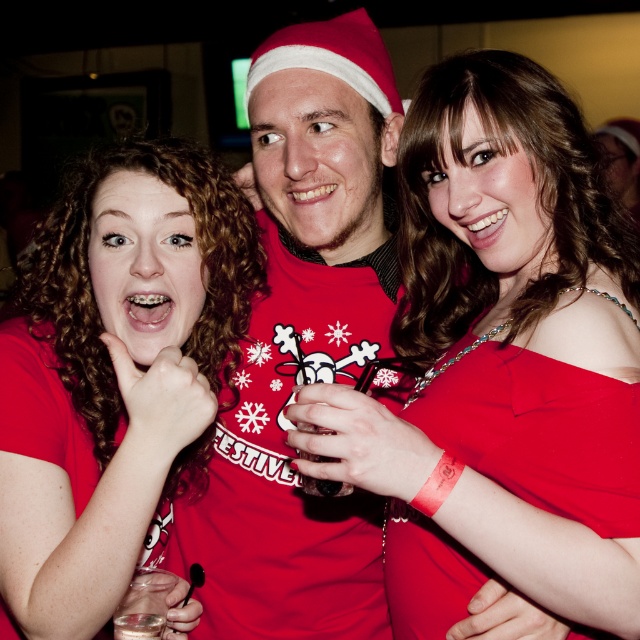
Question: Considering the real-world distances, which object is farthest from the matte red sweater at center?

Choices:
 (A) matte red dress at center
 (B) red satin dress at center
 (C) matte red shirt at center

Answer: (B)

Question: Which point appears closest to the camera in this image?

Choices:
 (A) (56, 451)
 (B) (449, 616)
 (C) (380, 252)
 (D) (582, 161)

Answer: (A)

Question: Which of the following is the farthest from the observer?

Choices:
 (A) coord(561,227)
 (B) coord(534,413)

Answer: (A)

Question: In this image, where is matte red dress at center located relative to matte red sweater at center?

Choices:
 (A) above
 (B) below

Answer: (B)

Question: Can you confirm if matte red shirt at center is thinner than red satin dress at center?

Choices:
 (A) yes
 (B) no

Answer: (B)

Question: Does matte red dress at center have a smaller size compared to matte red sweater at center?

Choices:
 (A) yes
 (B) no

Answer: (B)